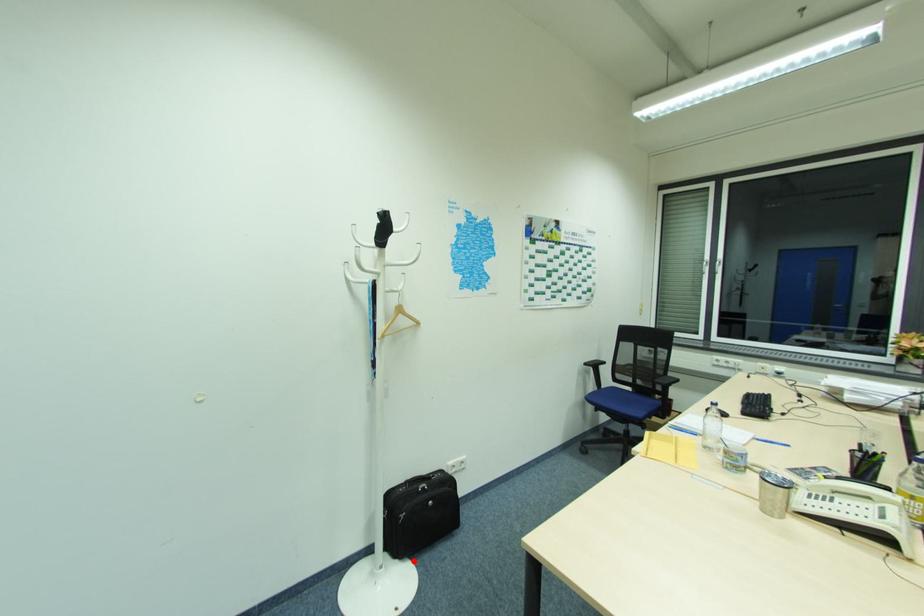
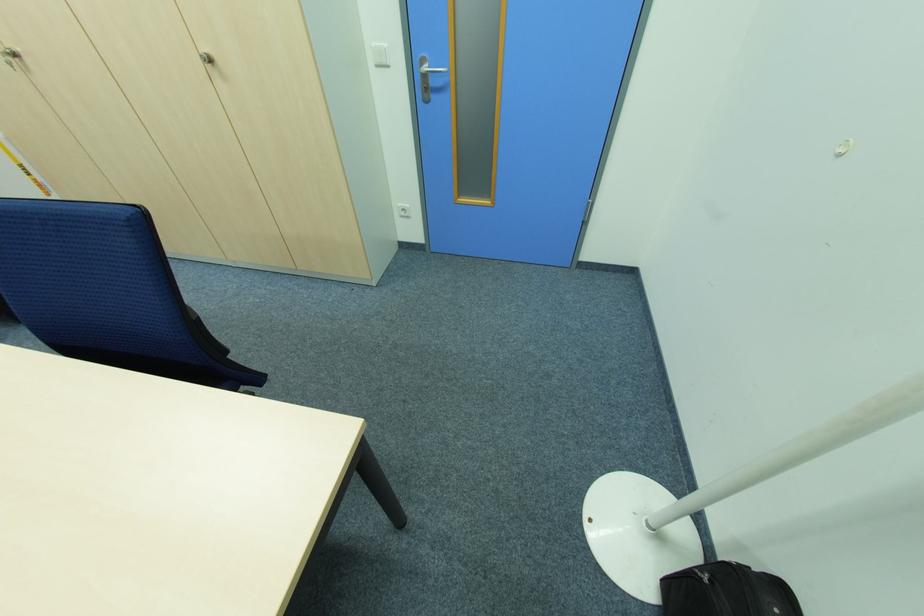
Question: I am providing you with two images of the same scene from different viewpoints. Image1 has a red point marked. In image2, the corresponding 3D location appears at what relative position? Reply with the corresponding letter.

Choices:
 (A) Closer
 (B) Farther

Answer: (A)